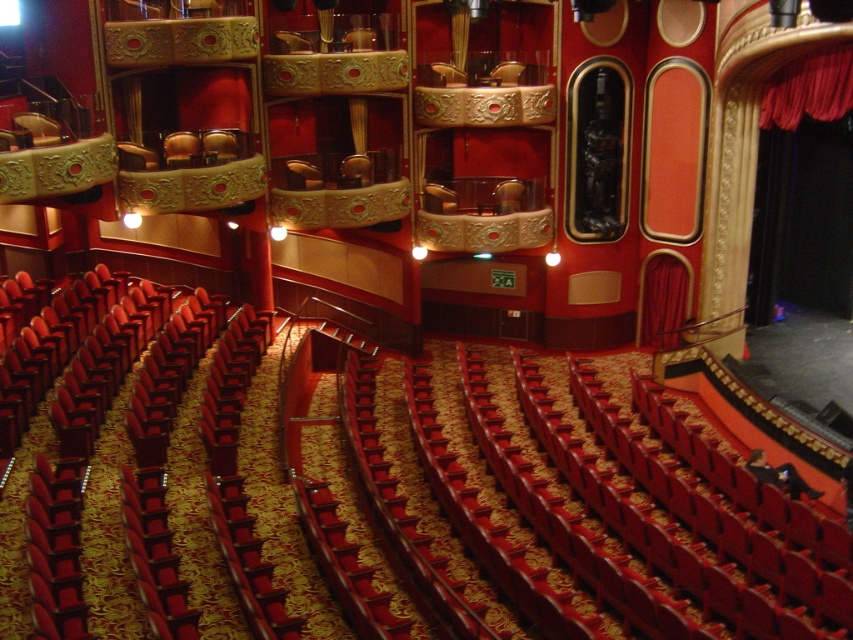
You are sitting in the theater and want to determine the relative positions of two points marked in the image. Which point is closer to you, point (764, 97) or point (190, 141)?

A: Point (764, 97) is closer to the viewer than point (190, 141).

You are an event planner setting up a stage in the theater. You need to decide whether to place a spotlight on the red velvet curtain at upper right or the matte gold chair at upper center. Based on their positions, which object is physically behind the other?

The red velvet curtain at upper right is positioned over matte gold chair at upper center, meaning it is physically behind the chair.